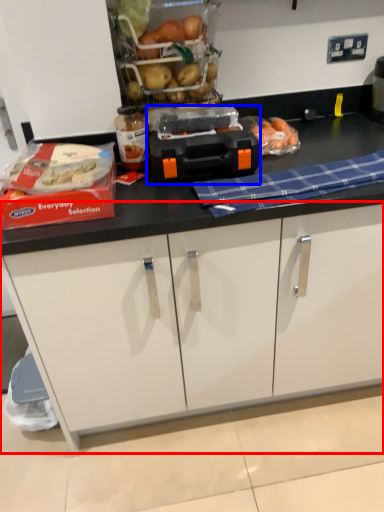
Question: Which object appears closest to the camera in this image, cabinetry (highlighted by a red box) or appliance (highlighted by a blue box)?

Choices:
 (A) cabinetry
 (B) appliance

Answer: (B)